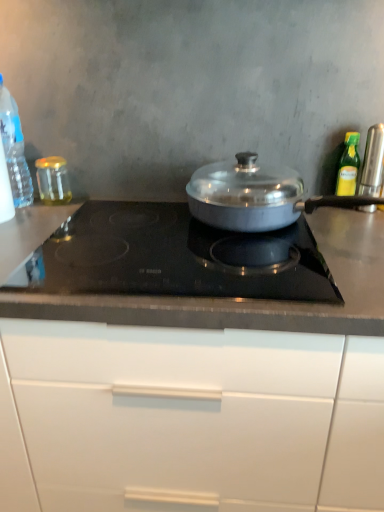
At what (x,y) coordinates should I click in order to perform the action: click on vacant region to the left of satin silver canister at right, which ranks as the 1th kitchen appliance in right-to-left order. Please return your answer as a coordinate pair (x, y). This screenshot has height=512, width=384. Looking at the image, I should click on (326, 223).